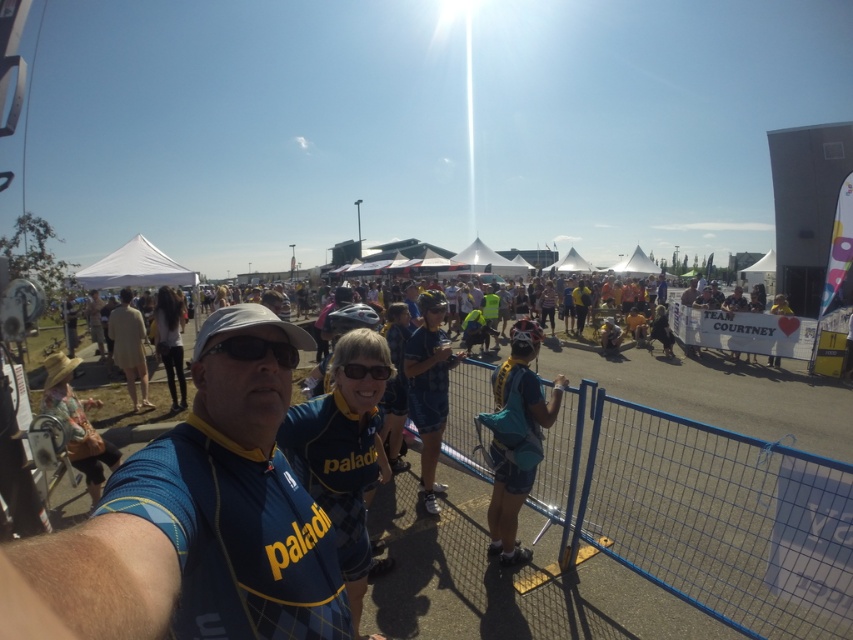
Is teal fabric backpack at center to the right of denim jacket at lower left from the viewer's perspective?

Indeed, teal fabric backpack at center is positioned on the right side of denim jacket at lower left.

This screenshot has width=853, height=640. I want to click on teal fabric backpack at center, so click(517, 438).

You are a GUI agent. You are given a task and a screenshot of the screen. Output one action in this format:
    pyautogui.click(x=<x>, y=<y>)
    Task: Click on the teal fabric backpack at center
    
    Given the screenshot: What is the action you would take?
    pyautogui.click(x=517, y=438)

Does blue fabric shirt at center appear over matte black goggles at center?

Actually, blue fabric shirt at center is below matte black goggles at center.

Who is positioned more to the right, blue fabric shirt at center or matte black goggles at center?

blue fabric shirt at center

Does point (419, 419) lie in front of point (349, 369)?

No, it is not.

The height and width of the screenshot is (640, 853). I want to click on blue fabric shirt at center, so click(x=428, y=388).

In the scene shown: Does blue jersey at center appear under blue wire mesh fence at center?

No, blue jersey at center is not below blue wire mesh fence at center.

Does blue jersey at center lie in front of blue wire mesh fence at center?

Yes.

You are a GUI agent. You are given a task and a screenshot of the screen. Output one action in this format:
    pyautogui.click(x=<x>, y=<y>)
    Task: Click on the blue jersey at center
    
    Given the screenshot: What is the action you would take?
    pyautogui.click(x=200, y=529)